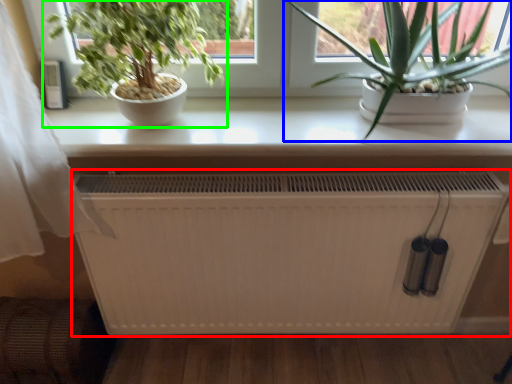
Question: Which is nearer to the heater (highlighted by a red box)? houseplant (highlighted by a blue box) or houseplant (highlighted by a green box).

Choices:
 (A) houseplant
 (B) houseplant

Answer: (A)